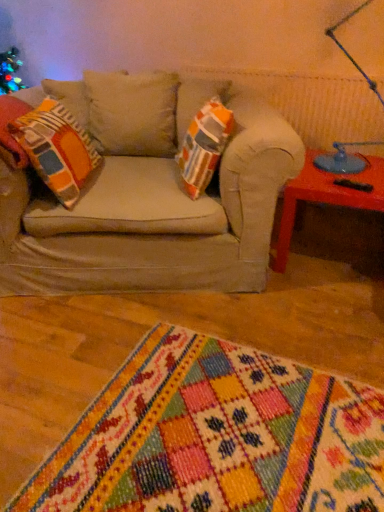
At what (x,y) coordinates should I click in order to perform the action: click on free space in front of blue glass table lamp at upper right. Please return your answer as a coordinate pair (x, y). Image resolution: width=384 pixels, height=512 pixels. Looking at the image, I should click on (345, 185).